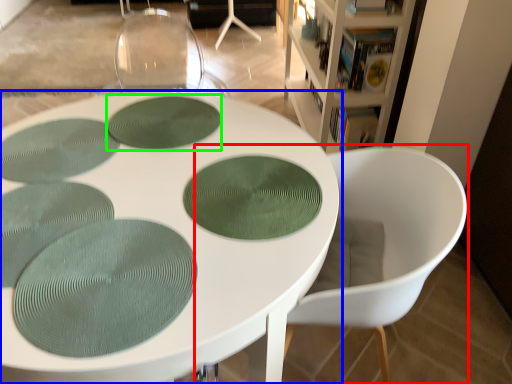
Question: Which object is positioned closest to chair (highlighted by a red box)? Select from table (highlighted by a blue box) and oval (highlighted by a green box).

Choices:
 (A) table
 (B) oval

Answer: (A)